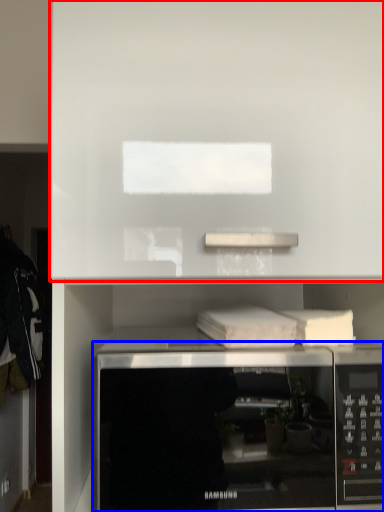
Question: Which object is further to the camera taking this photo, cabinet (highlighted by a red box) or microwave oven (highlighted by a blue box)?

Choices:
 (A) cabinet
 (B) microwave oven

Answer: (B)